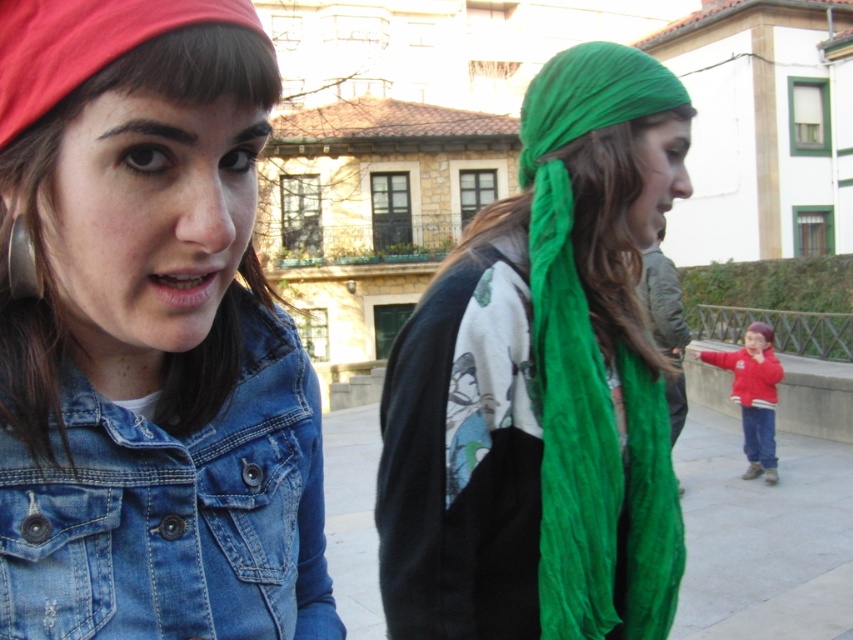
Between denim jacket at lower left and brownhair at left, which one has more height?

Standing taller between the two is denim jacket at lower left.

This screenshot has height=640, width=853. Find the location of `denim jacket at lower left`. denim jacket at lower left is located at coordinates (173, 512).

Where is `denim jacket at lower left`? The image size is (853, 640). denim jacket at lower left is located at coordinates (173, 512).

Does brownhair at left come behind red fleece jacket at right?

That is False.

Who is more distant from viewer, (32, 310) or (735, 387)?

Positioned behind is point (735, 387).

Which is in front, point (26, 381) or point (692, 352)?

Positioned in front is point (26, 381).

This screenshot has width=853, height=640. Find the location of `brownhair at left`. brownhair at left is located at coordinates (51, 179).

Looking at this image, is green crinkled scarf at center above red fleece jacket at right?

Yes.

Who is shorter, green crinkled scarf at center or red fleece jacket at right?

With less height is red fleece jacket at right.

Does point (489, 531) come behind point (753, 392)?

No, (489, 531) is closer to viewer.

Locate an element on the screen. This screenshot has width=853, height=640. green crinkled scarf at center is located at coordinates (543, 384).